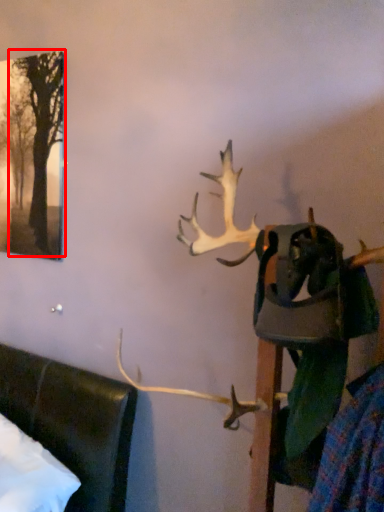
Question: Considering the relative positions of tree (annotated by the red box) and deer in the image provided, where is tree (annotated by the red box) located with respect to the staircase?

Choices:
 (A) right
 (B) left

Answer: (B)